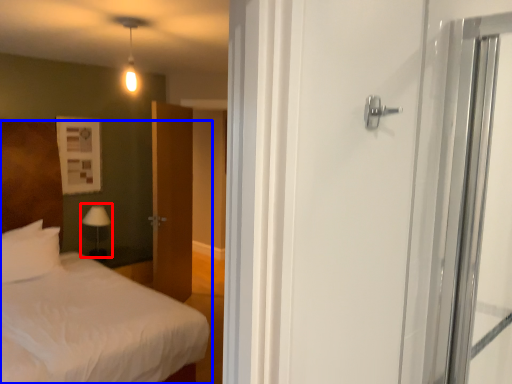
Question: Which object appears farthest to the camera in this image, table lamp (highlighted by a red box) or bed (highlighted by a blue box)?

Choices:
 (A) table lamp
 (B) bed

Answer: (A)